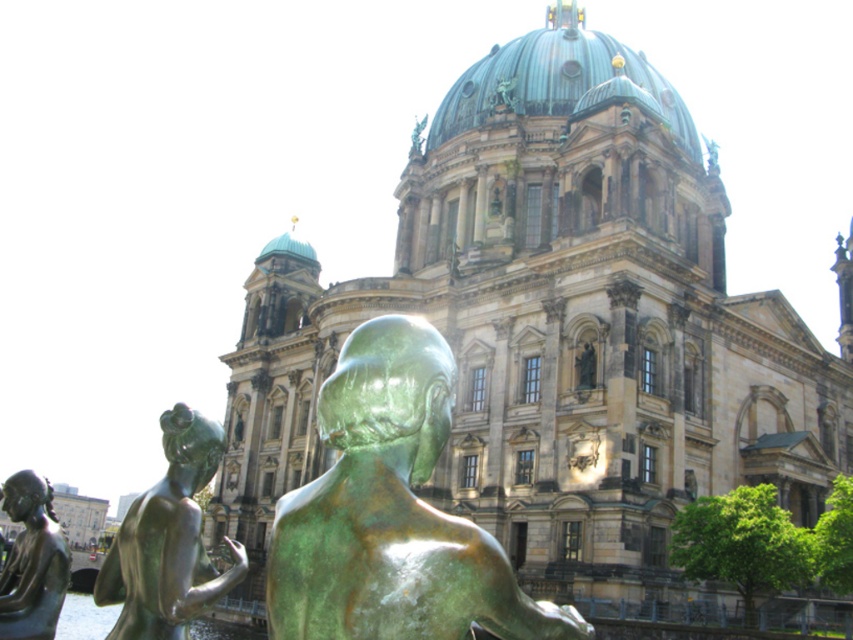
Locate an element on the screen. green patina statue at center is located at coordinates tap(392, 513).

Can you confirm if green patina statue at center is positioned above bronze statue at left?

Correct, green patina statue at center is located above bronze statue at left.

What do you see at coordinates (392, 513) in the screenshot? This screenshot has width=853, height=640. I see `green patina statue at center` at bounding box center [392, 513].

The width and height of the screenshot is (853, 640). I want to click on green patina statue at center, so click(392, 513).

Measure the distance between point (334,436) and camera.

31.02 meters

Does point (463, 621) come farther from viewer compared to point (184, 461)?

No, it is not.

The width and height of the screenshot is (853, 640). I want to click on green patina statue at center, so click(x=392, y=513).

Can you confirm if bronze statue at lower left is shorter than bronze statue at left?

No.

Between bronze statue at lower left and bronze statue at left, which one has more height?

bronze statue at lower left is taller.

Which is in front, point (115, 550) or point (28, 561)?

Point (115, 550) is more forward.

You are a GUI agent. You are given a task and a screenshot of the screen. Output one action in this format:
    pyautogui.click(x=<x>, y=<y>)
    Task: Click on the bronze statue at lower left
    The image size is (853, 640).
    Given the screenshot: What is the action you would take?
    pyautogui.click(x=167, y=540)